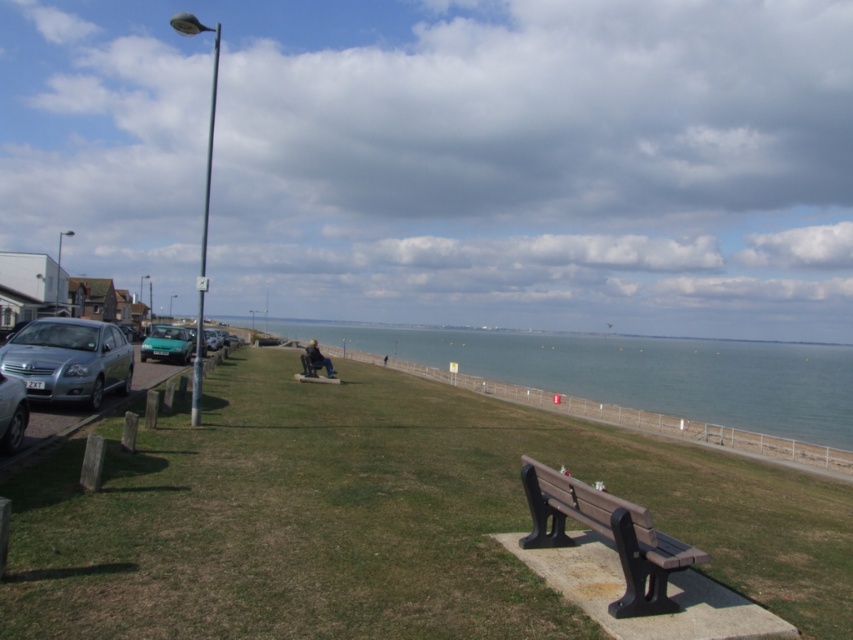
Question: Estimate the real-world distances between objects in this image. Which object is farther from the green grass at center?

Choices:
 (A) brown wood bench at lower right
 (B) green matte car at left
 (C) satin silver car at left
 (D) brown wooden bench at center

Answer: (B)

Question: Which is farther from the brown wood bench at lower right?

Choices:
 (A) brown wooden bench at center
 (B) green matte car at left

Answer: (B)

Question: Can you confirm if blue water at center is thinner than brown wooden bench at center?

Choices:
 (A) yes
 (B) no

Answer: (B)

Question: Is green grass at center in front of shiny silver car at left?

Choices:
 (A) yes
 (B) no

Answer: (A)

Question: Which point is farther to the camera?

Choices:
 (A) (305, 369)
 (B) (657, 397)
 (C) (161, 333)
 (D) (32, 362)

Answer: (B)

Question: Observing the image, what is the correct spatial positioning of green grass at center in reference to green matte car at left?

Choices:
 (A) left
 (B) right

Answer: (B)